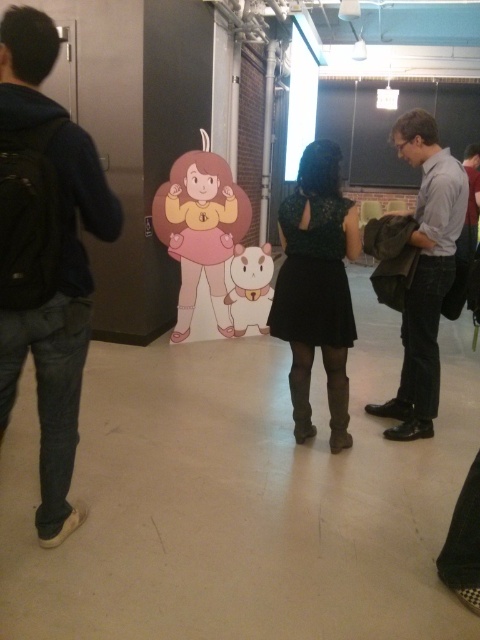
Which is behind, point (442, 152) or point (324, 362)?

The point (324, 362) is behind.

Is dark gray fabric jacket at right positioned behind green lace dress at center?

Yes, dark gray fabric jacket at right is behind green lace dress at center.

Locate an element on the screen. The width and height of the screenshot is (480, 640). dark gray fabric jacket at right is located at coordinates (418, 269).

Who is more distant from viewer, (x=20, y=96) or (x=394, y=138)?

The point (x=394, y=138) is more distant.

Is point (120, 220) behind point (452, 193)?

No, it is in front of (452, 193).

Does point (39, 268) come behind point (425, 346)?

No, (39, 268) is closer to viewer.

Locate an element on the screen. This screenshot has width=480, height=640. black backpack at left is located at coordinates pos(46,253).

Is black backpack at left above green lace dress at center?

No.

Can you confirm if black backpack at left is thinner than green lace dress at center?

Yes.

What do you see at coordinates (46, 253) in the screenshot?
I see `black backpack at left` at bounding box center [46, 253].

You are a GUI agent. You are given a task and a screenshot of the screen. Output one action in this format:
    pyautogui.click(x=<x>, y=<y>)
    Task: Click on the black backpack at left
    
    Given the screenshot: What is the action you would take?
    point(46,253)